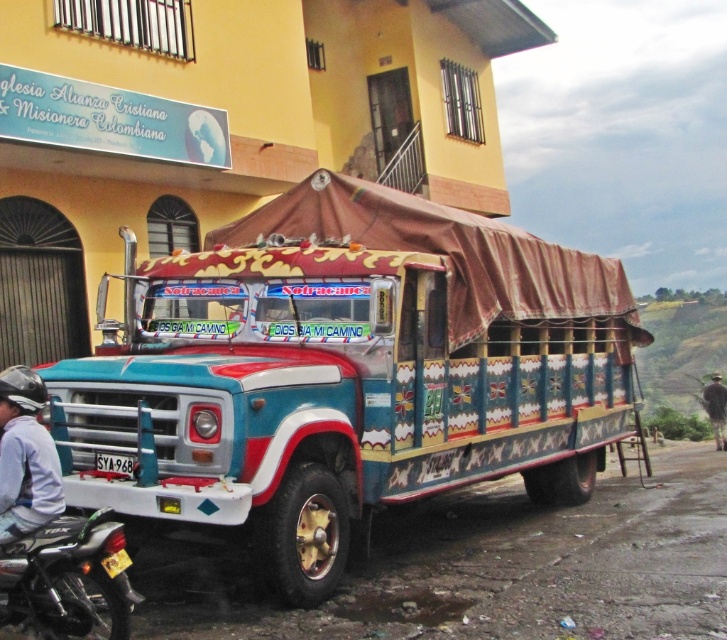
Question: Is brushed metal helmet at left positioned in front of brown fabric person at lower right?

Choices:
 (A) no
 (B) yes

Answer: (B)

Question: Which point is closer to the camera taking this photo?

Choices:
 (A) (20, 500)
 (B) (722, 422)
 (C) (390, 449)
 (D) (126, 465)

Answer: (A)

Question: Estimate the real-world distances between objects in this image. Which object is farther from the painted wood bus at center?

Choices:
 (A) brown fabric person at lower right
 (B) black plastic license plate at lower left
 (C) shiny black motorcycle at lower left
 (D) brushed metal helmet at left

Answer: (A)

Question: Which of the following is the farthest from the observer?

Choices:
 (A) (100, 412)
 (B) (723, 403)

Answer: (B)

Question: Does painted wood bus at center appear under brown fabric person at lower right?

Choices:
 (A) yes
 (B) no

Answer: (B)

Question: Does painted wood bus at center lie in front of shiny black motorcycle at lower left?

Choices:
 (A) no
 (B) yes

Answer: (A)